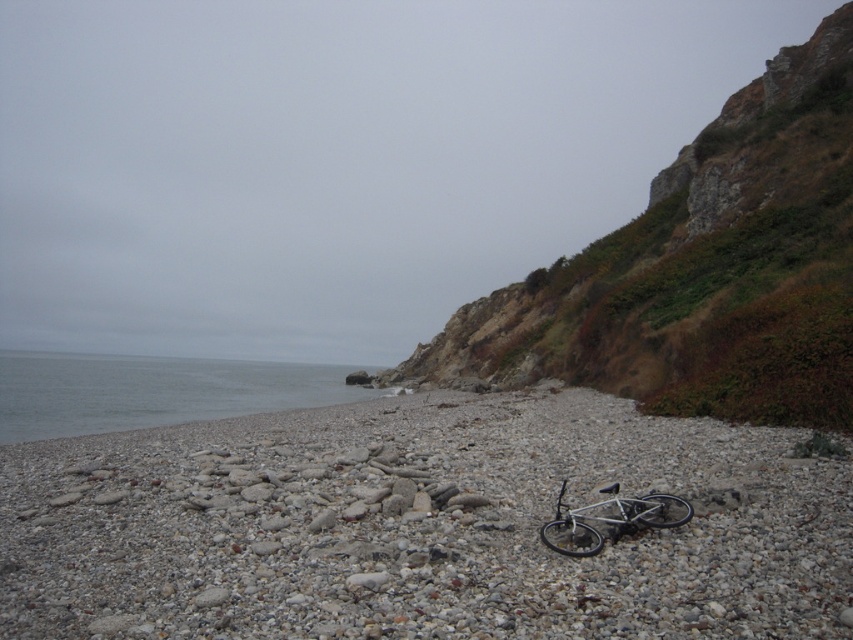
You are standing on the pebble beach looking towards the cliff. You see the gray smooth water at lower left and the silver metallic bicycle at center. Which object is closer to your right side?

The silver metallic bicycle at center is closer to your right side because it is to the right of the gray smooth water at lower left.